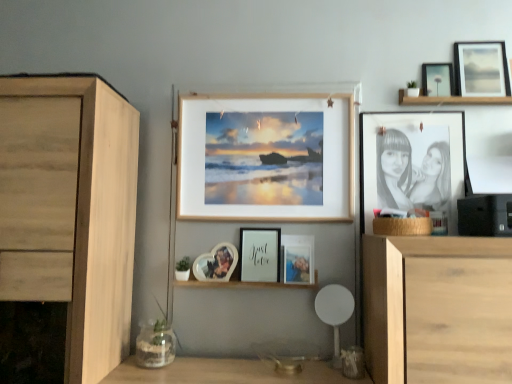
Question: Is clear glass vase at lower left to the right of matte black picture frame at upper right, the second picture frame from the right, from the viewer's perspective?

Choices:
 (A) yes
 (B) no

Answer: (B)

Question: Is clear glass vase at lower left thinner than matte black picture frame at upper right, the 6th picture frame in the left-to-right sequence?

Choices:
 (A) yes
 (B) no

Answer: (B)

Question: Is clear glass vase at lower left further to camera compared to matte black picture frame at upper right, the 6th picture frame in the left-to-right sequence?

Choices:
 (A) yes
 (B) no

Answer: (B)

Question: Can you confirm if clear glass vase at lower left is positioned to the left of matte black picture frame at upper right, the 6th picture frame in the left-to-right sequence?

Choices:
 (A) no
 (B) yes

Answer: (B)

Question: Can you confirm if clear glass vase at lower left is shorter than matte black picture frame at upper right, the 6th picture frame in the left-to-right sequence?

Choices:
 (A) no
 (B) yes

Answer: (A)

Question: Choose the correct answer: Is light wood cabinet at left inside matte black photo frame at center, which appears as the fourth picture frame when viewed from the right, or outside it?

Choices:
 (A) outside
 (B) inside

Answer: (A)

Question: In terms of size, does light wood cabinet at left appear bigger or smaller than matte black photo frame at center, positioned as the 4th picture frame in left-to-right order?

Choices:
 (A) big
 (B) small

Answer: (A)

Question: Visually, is light wood cabinet at left positioned to the left or to the right of matte black photo frame at center, positioned as the 4th picture frame in left-to-right order?

Choices:
 (A) left
 (B) right

Answer: (A)

Question: Does point (88, 296) appear closer or farther from the camera than point (288, 274)?

Choices:
 (A) closer
 (B) farther

Answer: (A)

Question: Considering the positions of point (331, 301) and point (482, 94), is point (331, 301) closer or farther from the camera than point (482, 94)?

Choices:
 (A) closer
 (B) farther

Answer: (A)

Question: From the image's perspective, is white plastic chair at lower center above or below matte wooden picture frame at upper right, the 1th picture frame when ordered from right to left?

Choices:
 (A) below
 (B) above

Answer: (A)

Question: From a real-world perspective, is white plastic chair at lower center positioned above or below matte wooden picture frame at upper right, the 1th picture frame when ordered from right to left?

Choices:
 (A) above
 (B) below

Answer: (B)

Question: Is white plastic chair at lower center wider or thinner than matte wooden picture frame at upper right, marked as the 7th picture frame in a left-to-right arrangement?

Choices:
 (A) thin
 (B) wide

Answer: (B)

Question: From a real-world perspective, relative to light wood cabinet at left, is clear glass vase at lower left vertically above or below?

Choices:
 (A) below
 (B) above

Answer: (A)

Question: Based on their positions, is clear glass vase at lower left located to the left or right of light wood cabinet at left?

Choices:
 (A) left
 (B) right

Answer: (B)